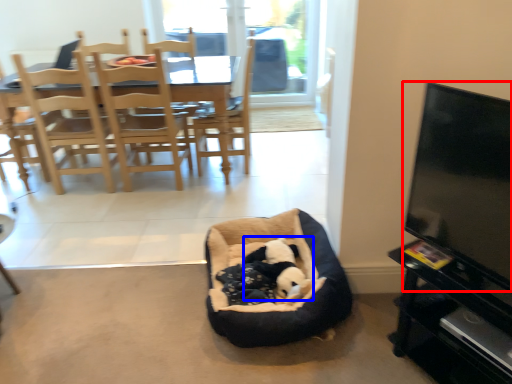
Question: Which of the following is the farthest to the observer, television (highlighted by a red box) or animal (highlighted by a blue box)?

Choices:
 (A) television
 (B) animal

Answer: (B)